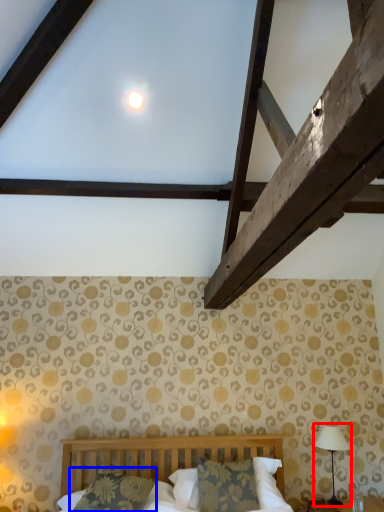
Question: Which object appears farthest to the camera in this image, table lamp (highlighted by a red box) or pillow (highlighted by a blue box)?

Choices:
 (A) table lamp
 (B) pillow

Answer: (A)